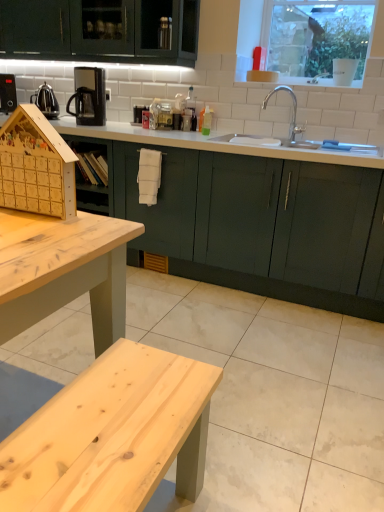
Question: Should I look upward or downward to see wooden advent calendar at left?

Choices:
 (A) up
 (B) down

Answer: (A)

Question: Considering the relative sizes of wooden advent calendar at left and white glossy countertop at center in the image provided, is wooden advent calendar at left bigger than white glossy countertop at center?

Choices:
 (A) yes
 (B) no

Answer: (B)

Question: Is wooden advent calendar at left thinner than white glossy countertop at center?

Choices:
 (A) no
 (B) yes

Answer: (B)

Question: Is wooden advent calendar at left outside white glossy countertop at center?

Choices:
 (A) no
 (B) yes

Answer: (B)

Question: Is wooden advent calendar at left smaller than white glossy countertop at center?

Choices:
 (A) no
 (B) yes

Answer: (B)

Question: Is wooden advent calendar at left not near white glossy countertop at center?

Choices:
 (A) no
 (B) yes

Answer: (B)

Question: Does wooden advent calendar at left appear on the left side of white glossy countertop at center?

Choices:
 (A) no
 (B) yes

Answer: (B)

Question: From the image's perspective, does polished stainless steel kettle at left appear lower than clear glass window at upper center?

Choices:
 (A) yes
 (B) no

Answer: (A)

Question: Is polished stainless steel kettle at left facing away from clear glass window at upper center?

Choices:
 (A) yes
 (B) no

Answer: (B)

Question: Is polished stainless steel kettle at left wider than clear glass window at upper center?

Choices:
 (A) no
 (B) yes

Answer: (B)

Question: Is polished stainless steel kettle at left positioned behind clear glass window at upper center?

Choices:
 (A) no
 (B) yes

Answer: (B)

Question: Is polished stainless steel kettle at left in front of clear glass window at upper center?

Choices:
 (A) yes
 (B) no

Answer: (B)

Question: Would you say polished stainless steel kettle at left contains clear glass window at upper center?

Choices:
 (A) yes
 (B) no

Answer: (B)

Question: Considering the relative sizes of white glossy countertop at center and polished stainless steel kettle at left in the image provided, is white glossy countertop at center smaller than polished stainless steel kettle at left?

Choices:
 (A) yes
 (B) no

Answer: (B)